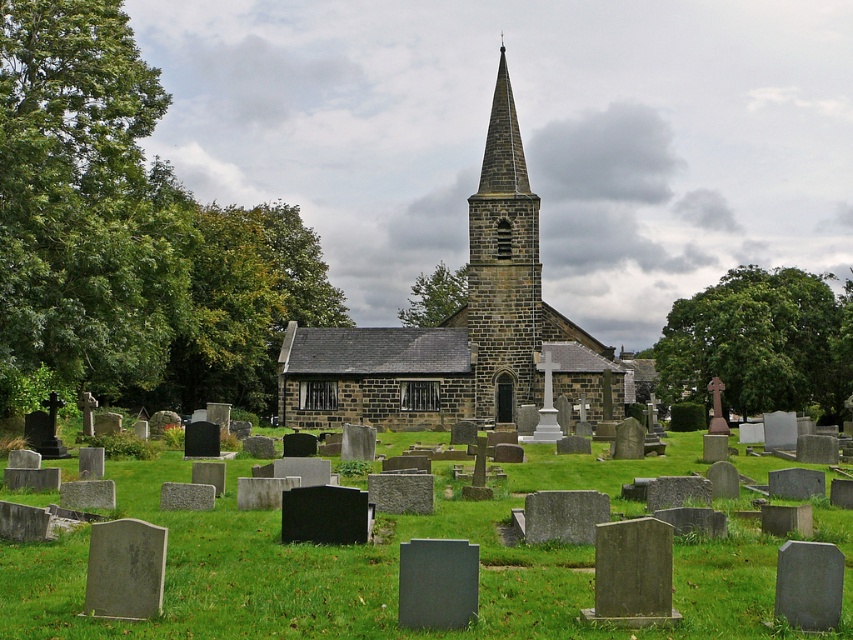
Question: Estimate the real-world distances between objects in this image. Which object is closer to the green leafy tree at left?

Choices:
 (A) green grass at center
 (B) brown stone church at center
 (C) green leafy tree at right
 (D) green leafy tree at center

Answer: (B)

Question: Which point is farther to the camera?

Choices:
 (A) (509, 236)
 (B) (521, 388)
 (C) (555, 458)
 (D) (688, 300)

Answer: (D)

Question: Based on their relative distances, which object is farther from the green leafy tree at left?

Choices:
 (A) brown stone steeple at center
 (B) green grass at center

Answer: (B)

Question: Is brown stone church at center smaller than brown stone steeple at center?

Choices:
 (A) yes
 (B) no

Answer: (B)

Question: Observing the image, what is the correct spatial positioning of brown stone church at center in reference to green leafy tree at right?

Choices:
 (A) right
 (B) left

Answer: (B)

Question: Is green leafy tree at left positioned before green leafy tree at center?

Choices:
 (A) no
 (B) yes

Answer: (B)